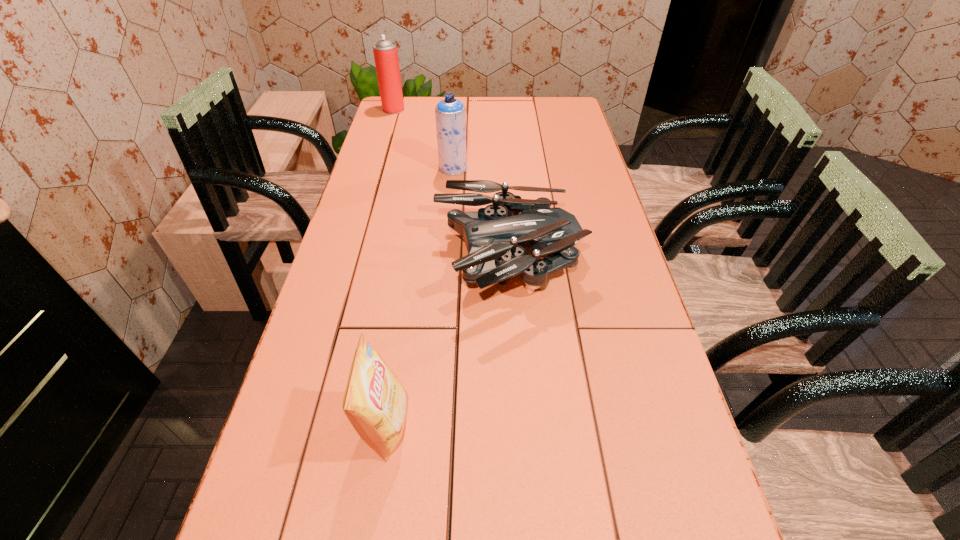
Identify the location of free space between the crisp (potato chip) and the nearer aerosol can. (419, 296).

I want to click on vacant point located between the nearest object and the shortest object, so click(x=446, y=344).

Find the location of `free space between the third nearest object and the crisp (potato chip)`. free space between the third nearest object and the crisp (potato chip) is located at coordinates (419, 296).

This screenshot has height=540, width=960. In order to click on free space between the third object from right to left and the drone in this screenshot , I will do `click(446, 344)`.

Where is `empty location between the third object from right to left and the third nearest object`? empty location between the third object from right to left and the third nearest object is located at coordinates (419, 296).

Identify the location of free space between the shortest object and the third object from right to left. The width and height of the screenshot is (960, 540). (446, 344).

The height and width of the screenshot is (540, 960). I want to click on blank region between the nearer aerosol can and the left aerosol can, so click(x=423, y=138).

Choose which object is the nearest neighbor to the third object from right to left. Please provide its 2D coordinates. Your answer should be formatted as a tuple, i.e. [(x, y)], where the tuple contains the x and y coordinates of a point satisfying the conditions above.

[(495, 236)]

Image resolution: width=960 pixels, height=540 pixels. I want to click on object that stands as the third closest to the right aerosol can, so click(374, 402).

Where is `free space that satisfies the following two spatial constraints: 1. on the front side of the nearer aerosol can; 2. on the front-facing side of the nearest object`? free space that satisfies the following two spatial constraints: 1. on the front side of the nearer aerosol can; 2. on the front-facing side of the nearest object is located at coordinates (x=433, y=424).